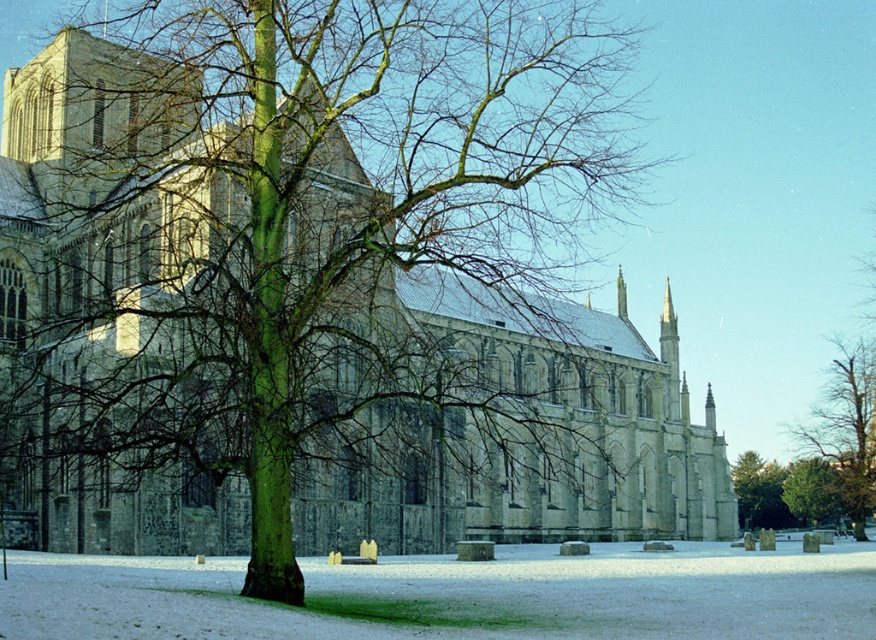
Question: Considering the real-world distances, which object is closest to the stone church at center?

Choices:
 (A) green rough bark tree at lower right
 (B) green bark tree at right
 (C) green rough bark tree at center

Answer: (B)

Question: Can you confirm if stone church at center is positioned to the left of green rough bark tree at center?

Choices:
 (A) no
 (B) yes

Answer: (B)

Question: Can you confirm if stone church at center is positioned to the right of green rough bark tree at lower right?

Choices:
 (A) yes
 (B) no

Answer: (B)

Question: Among these objects, which one is nearest to the camera?

Choices:
 (A) green rough bark tree at center
 (B) green bark tree at right
 (C) stone church at center

Answer: (C)

Question: Considering the real-world distances, which object is closest to the green bark tree at right?

Choices:
 (A) green rough bark tree at lower right
 (B) green rough bark tree at center
 (C) stone church at center

Answer: (B)

Question: Does green rough bark tree at center appear over green rough bark tree at lower right?

Choices:
 (A) no
 (B) yes

Answer: (A)